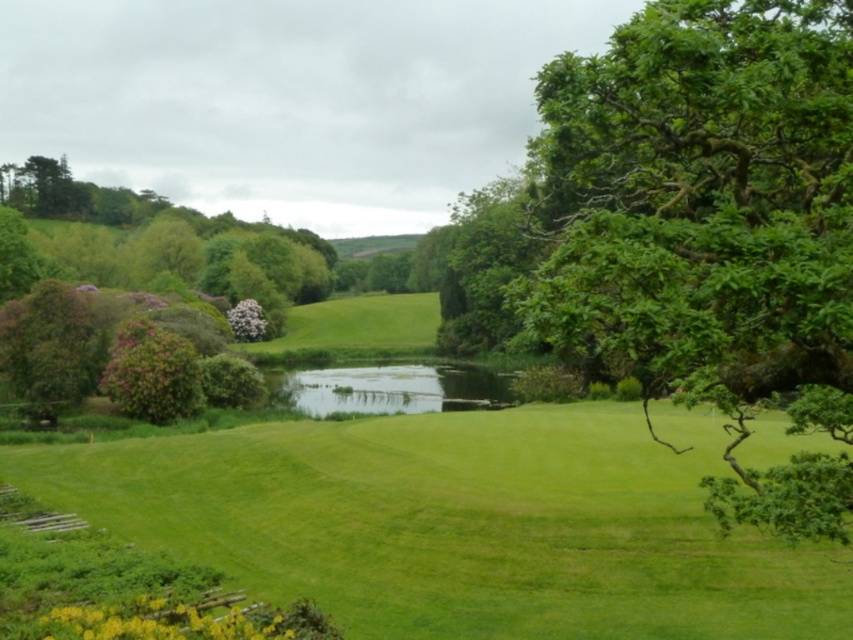
Consider the image. You are planning to place a picnic blanket in this garden scene. The picnic blanket is 2 meters wide. You want to place it under the green leafy tree at center right and next to the green grassy lake at center. Will the picnic blanket fit entirely under the tree without overlapping the lake?

The green leafy tree at center right is narrower than the green grassy lake at center. Since the tree is narrower, placing a 2m wide picnic blanket under it might not fit entirely without overlapping the lake unless the tree has sufficient width. However, since the tree is narrower than the lake, it may not provide enough space. The exact fit depends on the tree width, but given the description, the tree is narrower than the lake, so the blanket may overlap the lake.

Consider the image. You are standing in the garden and want to reach the point marked at coordinates (718, 273). Considering the layout of the grassy area and the pond, is this point accessible by walking directly from your current position?

The point at coordinates (718, 273) is 19.21 feet away from the viewer. Since the path is across the grassy area and the pond is in the middle ground, you can walk directly to the point as there are no obstacles mentioned in the scene description.

You are standing in the garden and want to walk from the green leafy tree at center right to the green grassy lake at center. Which direction should you move to reach the lake from the tree?

To reach the green grassy lake at center from the green leafy tree at center right, you should move to the left because the tree is positioned over the lake, meaning the lake is directly below it in the scene.